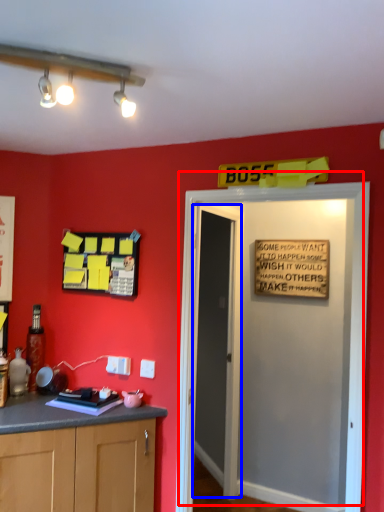
Question: Which object appears farthest to the camera in this image, door (highlighted by a red box) or door (highlighted by a blue box)?

Choices:
 (A) door
 (B) door

Answer: (B)